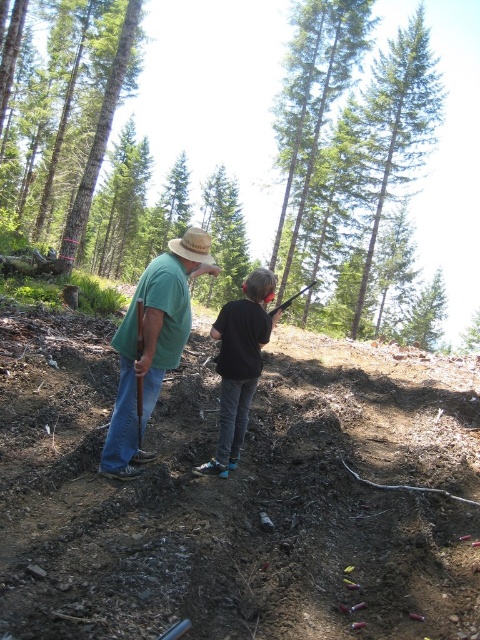
You are a hiker who needs to decide which item to pack for a trip. The black matte shirt at center is narrower than the green matte tree at center. Which item has a smaller width?

The black matte shirt at center has a smaller width than the green matte tree at center.

Based on the coordinates provided, what object is located at point (383, 145) in the image?

The point (383, 145) corresponds to the green leafy tree at upper center.